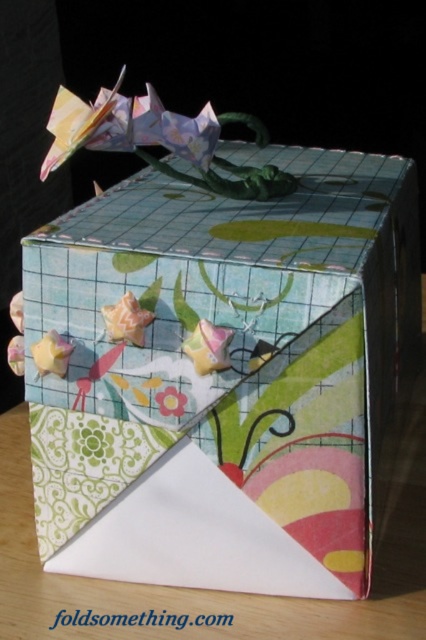
You are an interior designer arranging items on a shelf. You have a decorative paper box at center and a pastel floral paper flower at center. According to the image, which item is more to the right?

The decorative paper box at center is positioned on the right side of the pastel floral paper flower at center, so the decorative paper box at center is more to the right.

You are an interior designer arranging items on a table. You have a decorative paper box at center and a pastel floral paper flower at center. Which object is closer to you?

The decorative paper box at center is closer to you because it is in front of the pastel floral paper flower at center.

You are an interior designer arranging items on a shelf. You have a decorative paper box at center and a pastel floral paper flower at center. Which item will have a taller silhouette when placed side by side?

The decorative paper box at center has a greater height compared to the pastel floral paper flower at center, so it will have a taller silhouette when placed side by side.